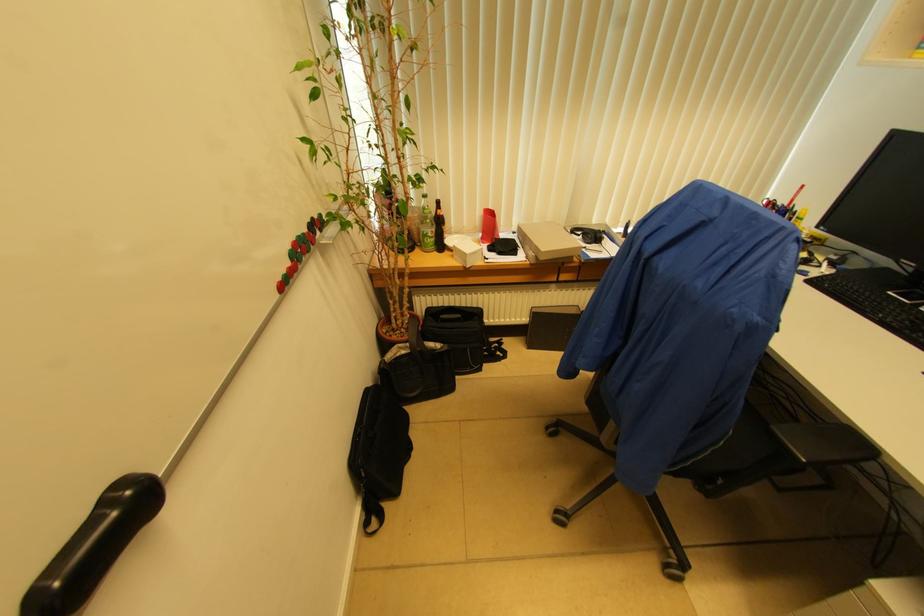
Which object does [546,241] point to?

It refers to a cardboard box.